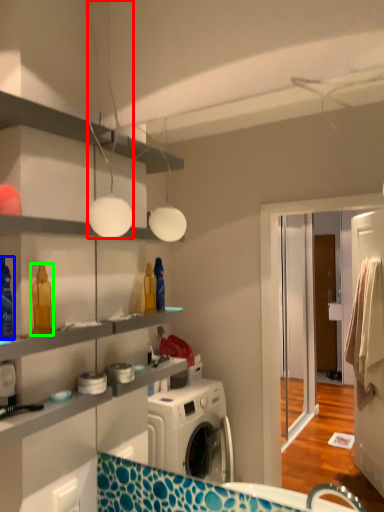
Question: Which object is positioned farthest from light fixture (highlighted by a red box)? Select from cleaning product (highlighted by a blue box) and cleaning product (highlighted by a green box).

Choices:
 (A) cleaning product
 (B) cleaning product

Answer: (A)